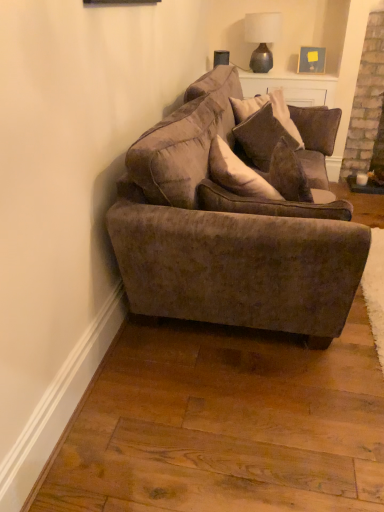
Question: Are velvet brown couch at center and velvet brown pillow at center located far from each other?

Choices:
 (A) yes
 (B) no

Answer: (B)

Question: Can you confirm if velvet brown couch at center is smaller than velvet brown pillow at center?

Choices:
 (A) no
 (B) yes

Answer: (A)

Question: Is velvet brown pillow at center located within velvet brown couch at center?

Choices:
 (A) no
 (B) yes

Answer: (B)

Question: Is velvet brown couch at center behind velvet brown pillow at center?

Choices:
 (A) no
 (B) yes

Answer: (A)

Question: Can you see velvet brown couch at center touching velvet brown pillow at center?

Choices:
 (A) no
 (B) yes

Answer: (A)

Question: Does velvet brown couch at center turn towards velvet brown pillow at center?

Choices:
 (A) no
 (B) yes

Answer: (B)

Question: Is matte gray glass lamp at upper center positioned in front of velvet brown couch at center?

Choices:
 (A) yes
 (B) no

Answer: (B)

Question: Is matte gray glass lamp at upper center not close to velvet brown couch at center?

Choices:
 (A) no
 (B) yes

Answer: (B)

Question: Can you confirm if matte gray glass lamp at upper center is thinner than velvet brown couch at center?

Choices:
 (A) no
 (B) yes

Answer: (B)

Question: Is matte gray glass lamp at upper center taller than velvet brown couch at center?

Choices:
 (A) yes
 (B) no

Answer: (B)

Question: Considering the relative sizes of matte gray glass lamp at upper center and velvet brown couch at center in the image provided, is matte gray glass lamp at upper center wider than velvet brown couch at center?

Choices:
 (A) yes
 (B) no

Answer: (B)

Question: From a real-world perspective, is matte gray glass lamp at upper center under velvet brown couch at center?

Choices:
 (A) no
 (B) yes

Answer: (A)

Question: Is velvet brown pillow at center located outside matte gray glass lamp at upper center?

Choices:
 (A) no
 (B) yes

Answer: (B)